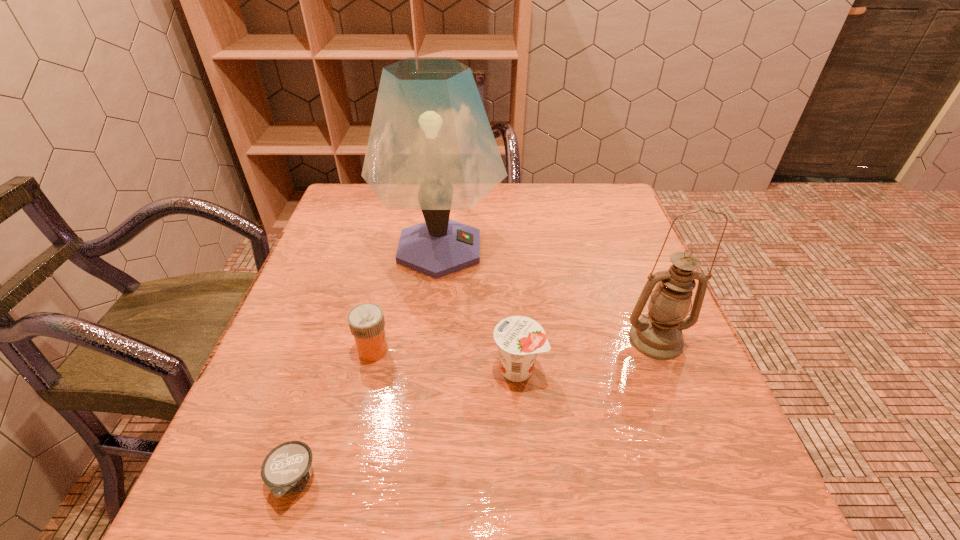
Locate an element on the screen. The height and width of the screenshot is (540, 960). vacant space located 0.290m on the front of the oil lamp is located at coordinates (729, 525).

Locate an element on the screen. The height and width of the screenshot is (540, 960). free space located 0.290m on the label side of the medicine is located at coordinates 539,350.

Image resolution: width=960 pixels, height=540 pixels. What are the coordinates of `vacant space positioned 0.060m on the front of the farther yogurt` in the screenshot? It's located at (522, 419).

Find the location of a particular element. This screenshot has height=540, width=960. vacant space located on the right of the nearer yogurt is located at coordinates (463, 481).

At what (x,y) coordinates should I click in order to perform the action: click on object at the far edge. Please return your answer as a coordinate pair (x, y). The width and height of the screenshot is (960, 540). Looking at the image, I should click on (431, 147).

Where is `object at the near edge`? object at the near edge is located at coordinates (287, 468).

You are a GUI agent. You are given a task and a screenshot of the screen. Output one action in this format:
    pyautogui.click(x=<x>, y=<y>)
    Task: Click on the lampshade present at the left edge
    The image size is (960, 540).
    Given the screenshot: What is the action you would take?
    pyautogui.click(x=431, y=147)

Where is `yogurt that is positioned at the left edge`? The height and width of the screenshot is (540, 960). yogurt that is positioned at the left edge is located at coordinates (287, 468).

At what (x,y) coordinates should I click in order to perform the action: click on object that is at the right edge. Please return your answer as a coordinate pair (x, y). The height and width of the screenshot is (540, 960). Looking at the image, I should click on (658, 335).

This screenshot has width=960, height=540. In order to click on object that is at the far left corner in this screenshot , I will do `click(431, 147)`.